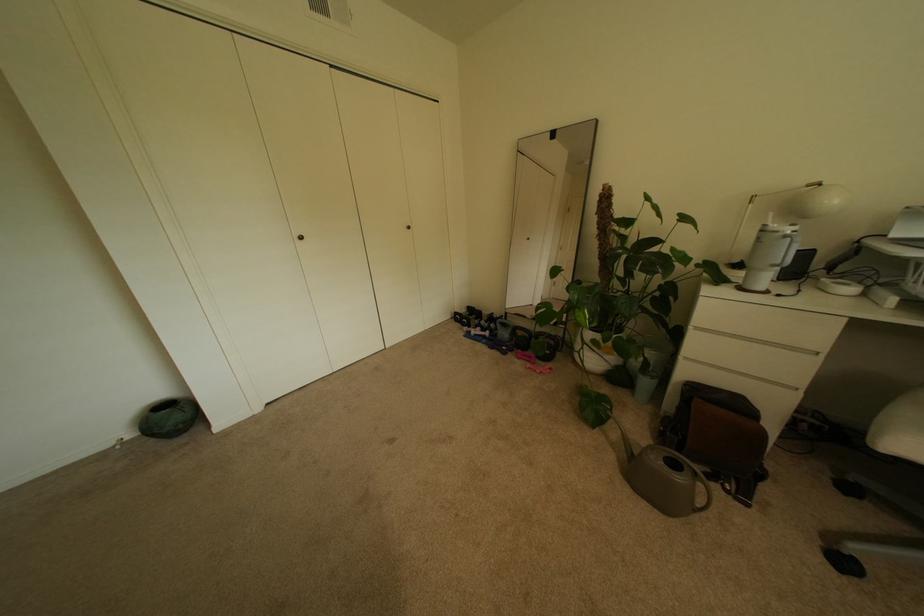
Find where to lift the kettlebell handle. Please return your answer as a coordinate pair (x, y).

(520, 338)